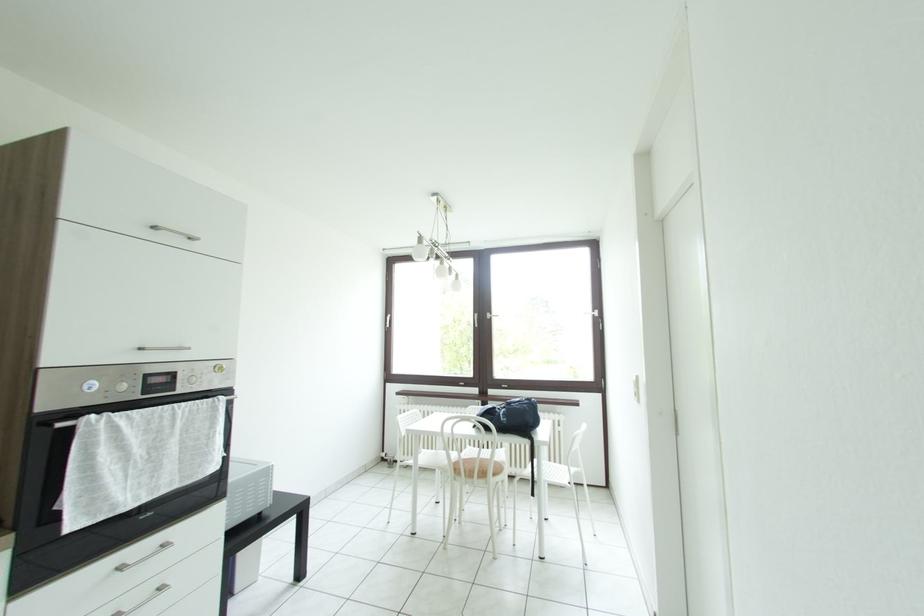
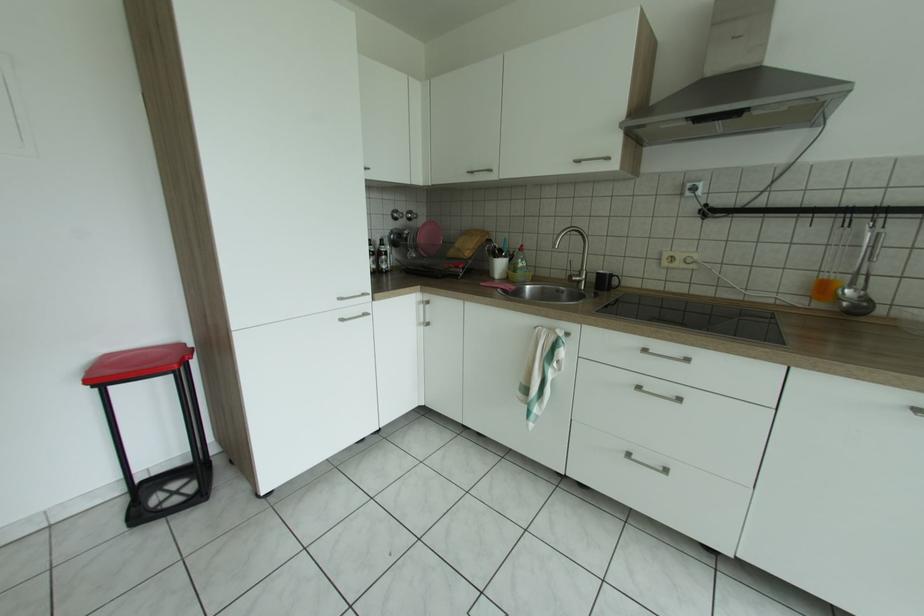
Question: The images are taken continuously from a first-person perspective. In which direction is your viewpoint rotating?

Choices:
 (A) Left
 (B) Right
 (C) Up
 (D) Down

Answer: (A)